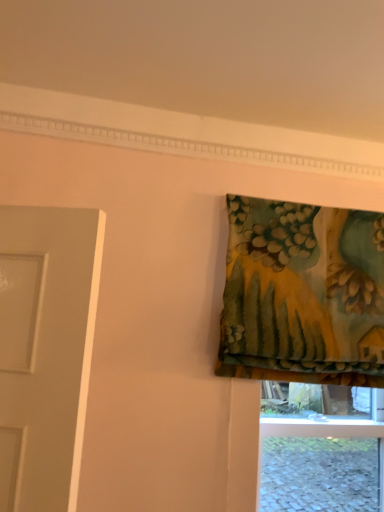
Locate an element on the screen. The image size is (384, 512). textured floral fabric at upper right is located at coordinates coord(303,294).

What do you see at coordinates (303, 294) in the screenshot? The width and height of the screenshot is (384, 512). I see `textured floral fabric at upper right` at bounding box center [303, 294].

Find the location of a particular element. textured floral fabric at upper right is located at coordinates (303, 294).